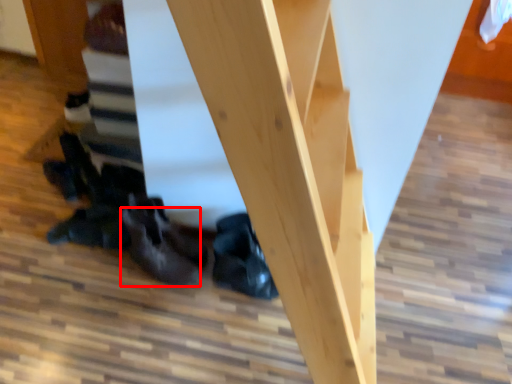
Question: Observing the image, what is the correct spatial positioning of leather shoe (annotated by the red box) in reference to leather shoe?

Choices:
 (A) left
 (B) right

Answer: (A)